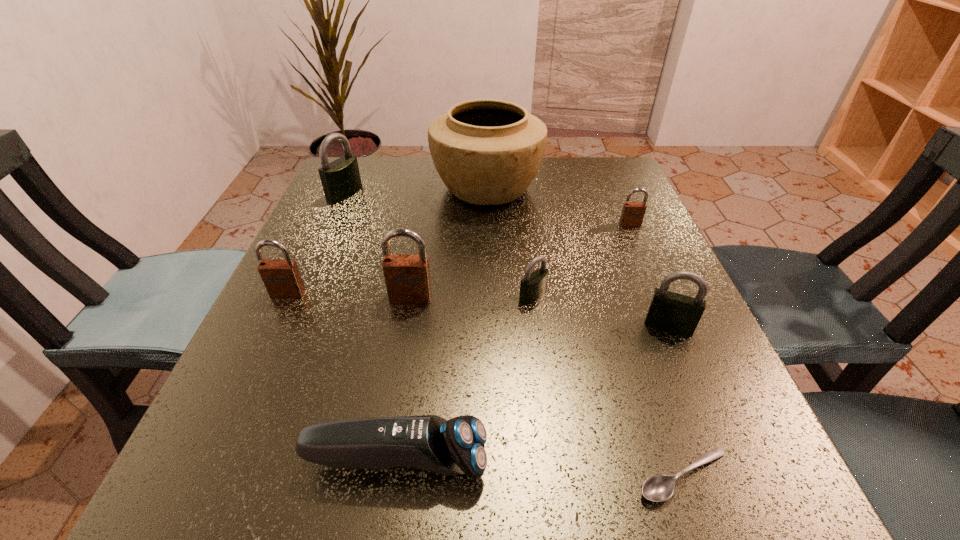
This screenshot has width=960, height=540. I want to click on vacant area that satisfies the following two spatial constraints: 1. on the front-facing side of the leftmost brown padlock; 2. on the right side of the rightmost black padlock, so click(x=273, y=326).